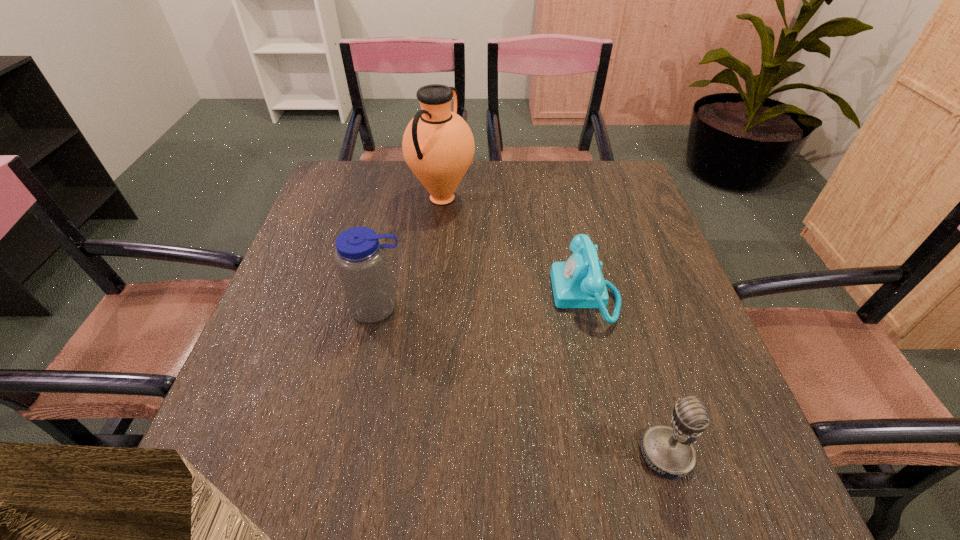
At what (x,y) coordinates should I click in order to perform the action: click on vacant area that lies between the microphone and the second tallest object. Please return your answer as a coordinate pair (x, y). The height and width of the screenshot is (540, 960). Looking at the image, I should click on (522, 381).

Locate an element on the screen. The width and height of the screenshot is (960, 540). empty space that is in between the farthest object and the shortest object is located at coordinates (514, 246).

Locate an element on the screen. This screenshot has height=540, width=960. free area in between the nearest object and the shortest object is located at coordinates (626, 374).

Locate an element on the screen. The image size is (960, 540). free space between the farthest object and the shortest object is located at coordinates (514, 246).

I want to click on object that is the second closest to the second tallest object, so click(x=577, y=283).

Locate an element on the screen. The height and width of the screenshot is (540, 960). object that is the third closest to the nearest object is located at coordinates (438, 145).

Where is `free space that satisfies the following two spatial constraints: 1. on the dial of the telephone; 2. with a carrying loop on the side of the water bottle`? free space that satisfies the following two spatial constraints: 1. on the dial of the telephone; 2. with a carrying loop on the side of the water bottle is located at coordinates (588, 307).

Where is `free space that satisfies the following two spatial constraints: 1. on the dial of the telephone; 2. with a carrying loop on the side of the second tallest object`? This screenshot has height=540, width=960. free space that satisfies the following two spatial constraints: 1. on the dial of the telephone; 2. with a carrying loop on the side of the second tallest object is located at coordinates (588, 307).

Find the location of `vacant area that satisfies the following two spatial constraints: 1. on the dial of the shortest object; 2. with a carrying loop on the side of the third shortest object`. vacant area that satisfies the following two spatial constraints: 1. on the dial of the shortest object; 2. with a carrying loop on the side of the third shortest object is located at coordinates (588, 307).